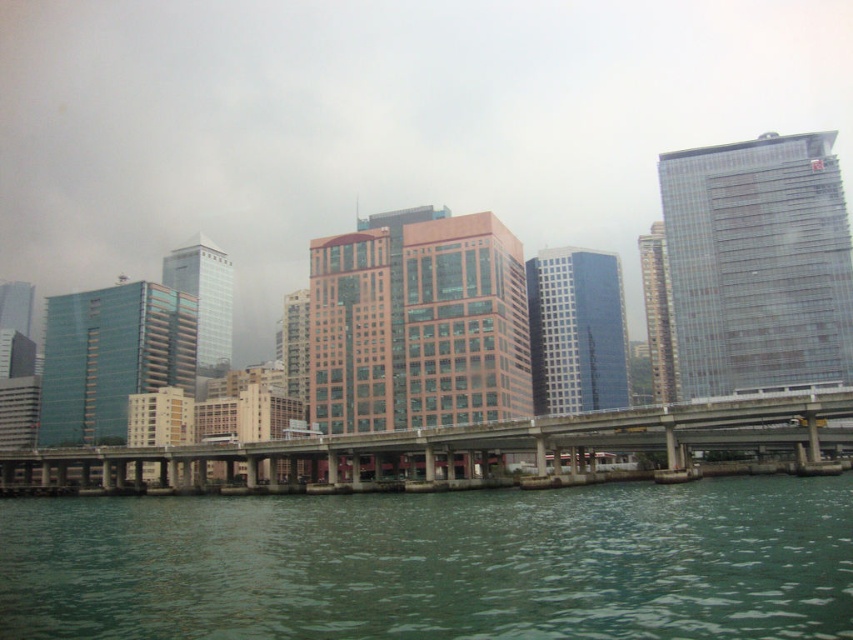
Question: Which object appears closest to the camera in this image?

Choices:
 (A) green water at lower center
 (B) concrete bridge at center
 (C) metallic glass tower at center
 (D) transparent glass building at right

Answer: (A)

Question: Which point is closer to the camera?

Choices:
 (A) (817, 333)
 (B) (73, 332)
 (C) (693, 435)

Answer: (C)

Question: Is green water at lower center to the right of concrete bridge at center from the viewer's perspective?

Choices:
 (A) no
 (B) yes

Answer: (B)

Question: From the image, what is the correct spatial relationship of green water at lower center in relation to green glass building at center?

Choices:
 (A) above
 (B) below

Answer: (B)

Question: Among these points, which one is farthest from the camera?

Choices:
 (A) (225, 369)
 (B) (775, 316)
 (C) (103, 417)

Answer: (A)

Question: Can you confirm if transparent glass building at left is bigger than clear glass skyscraper at center?

Choices:
 (A) no
 (B) yes

Answer: (A)